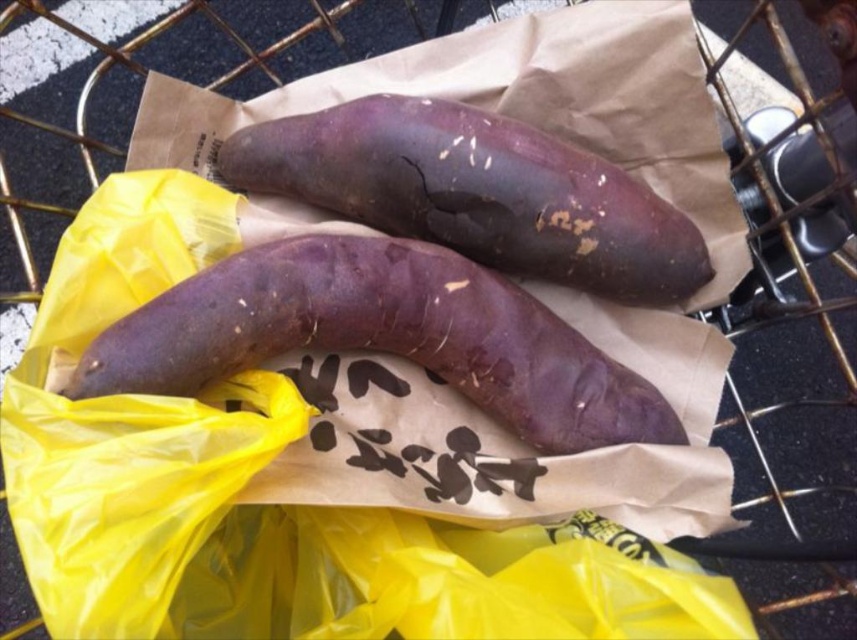
The height and width of the screenshot is (640, 857). I want to click on purple matte/skinny potato at center, so pos(382,337).

Is the position of purple matte/skinny potato at center more distant than that of purple matte sweet potato at center?

That is False.

Does point (435, 310) come in front of point (481, 257)?

Yes, point (435, 310) is closer to viewer.

The width and height of the screenshot is (857, 640). I want to click on purple matte/skinny potato at center, so click(x=382, y=337).